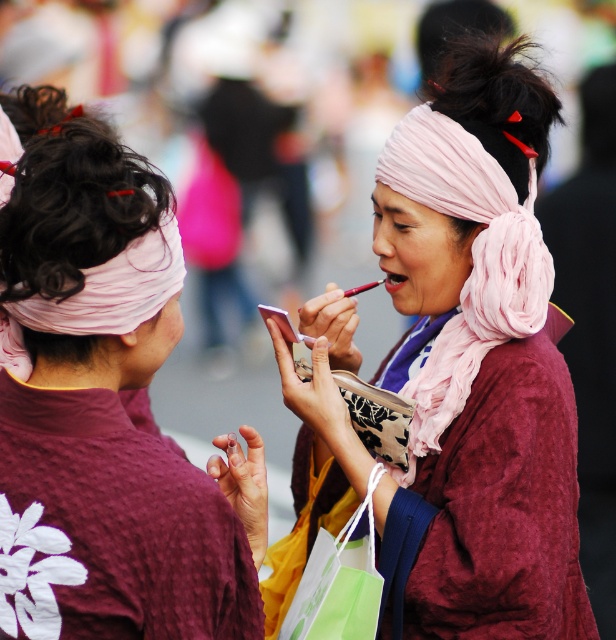
Between maroon textured robe at back and pink fabric headscarf at center, which one has more height?

pink fabric headscarf at center

Between point (158, 540) and point (397, 124), which one is positioned behind?

The point (397, 124) is behind.

Between point (136, 528) and point (434, 189), which one is positioned behind?

Positioned behind is point (434, 189).

Identify the location of maroon textured robe at back. (111, 528).

Does pink silk scarf at center have a greater height compared to matte pink lipstick at center?

Yes.

Is pink silk scarf at center above matte pink lipstick at center?

Incorrect, pink silk scarf at center is not positioned above matte pink lipstick at center.

The width and height of the screenshot is (616, 640). Find the location of `pink silk scarf at center`. pink silk scarf at center is located at coordinates (476, 365).

Between pink silk scarf at center and matte pink kimono at center, which one appears on the right side from the viewer's perspective?

From the viewer's perspective, pink silk scarf at center appears more on the right side.

Which is below, pink silk scarf at center or matte pink kimono at center?

Positioned lower is matte pink kimono at center.

Does point (338, 324) come closer to viewer compared to point (126, 284)?

No, (338, 324) is behind (126, 284).

Where is `pink silk scarf at center`? This screenshot has height=640, width=616. pink silk scarf at center is located at coordinates (476, 365).